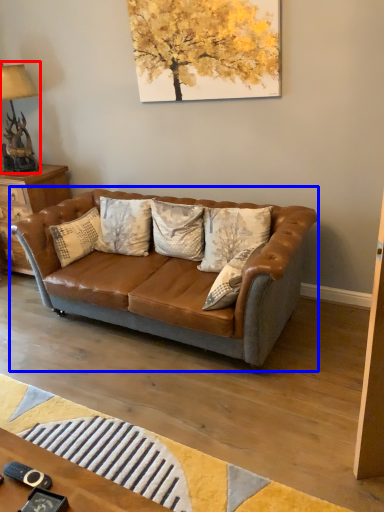
Question: Which object appears closest to the camera in this image, lamp (highlighted by a red box) or studio couch (highlighted by a blue box)?

Choices:
 (A) lamp
 (B) studio couch

Answer: (B)